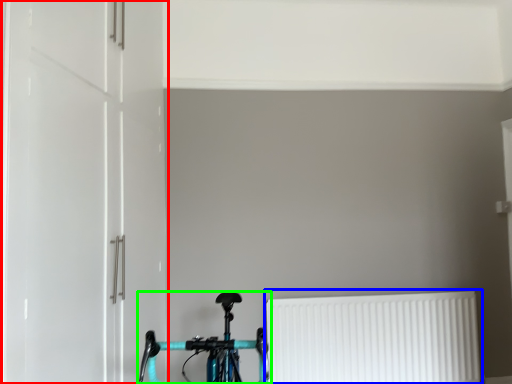
Question: Estimate the real-world distances between objects in this image. Which object is farther from door (highlighted by a red box), radiator (highlighted by a blue box) or bicycle (highlighted by a green box)?

Choices:
 (A) radiator
 (B) bicycle

Answer: (A)